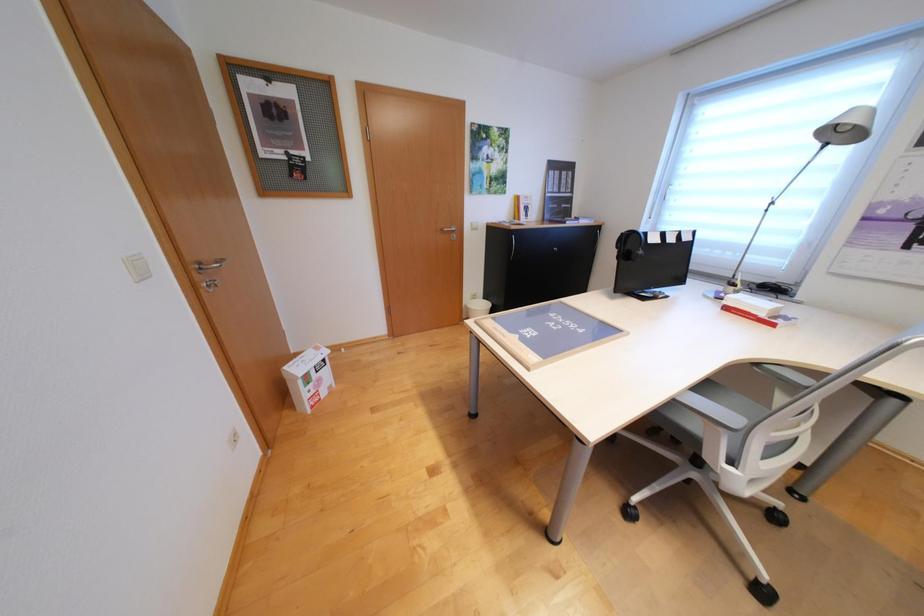
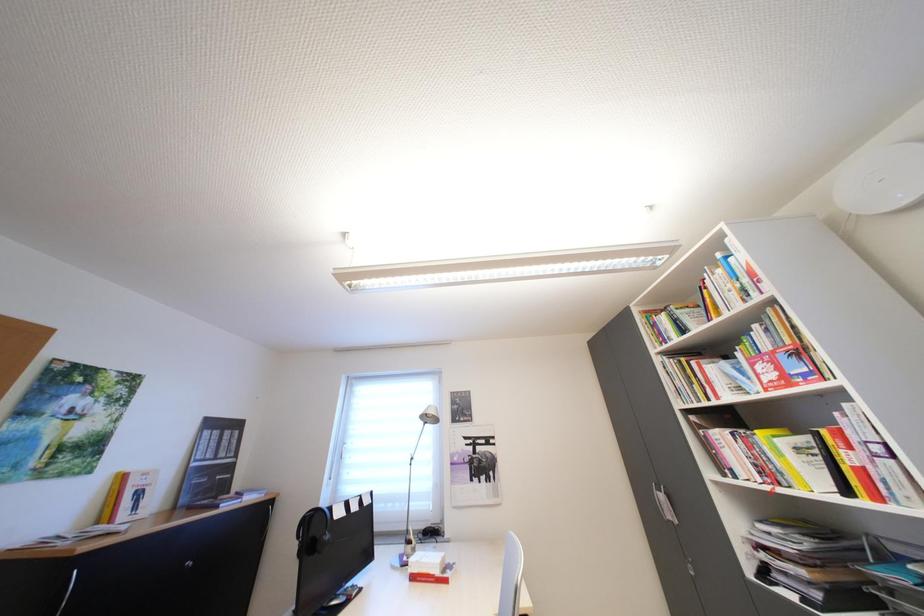
How did the camera likely rotate?

The camera rotated toward right-up.